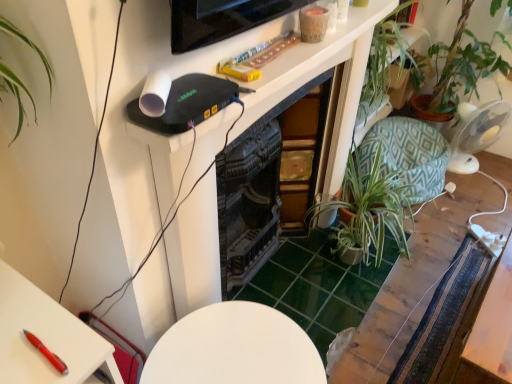
Question: Does green leafy plant at center-right have a greater height compared to wooden table at center, which is counted as the first table, starting from the back?

Choices:
 (A) no
 (B) yes

Answer: (B)

Question: Does green leafy plant at center-right have a smaller size compared to wooden table at center, which is counted as the first table, starting from the back?

Choices:
 (A) no
 (B) yes

Answer: (A)

Question: Considering the relative positions of green leafy plant at center-right and wooden table at center, which is counted as the first table, starting from the back, in the image provided, is green leafy plant at center-right to the right of wooden table at center, which is counted as the first table, starting from the back, from the viewer's perspective?

Choices:
 (A) no
 (B) yes

Answer: (A)

Question: Is green leafy plant at center-right with wooden table at center, which ranks as the 3th table in front-to-back order?

Choices:
 (A) yes
 (B) no

Answer: (B)

Question: Does green leafy plant at center-right appear on the left side of wooden table at center, which ranks as the 3th table in front-to-back order?

Choices:
 (A) no
 (B) yes

Answer: (B)

Question: Is white glossy table at center, marked as the 1th table in a front-to-back arrangement, wider or thinner than wooden table at center, which ranks as the 3th table in front-to-back order?

Choices:
 (A) wide
 (B) thin

Answer: (B)

Question: Considering the positions of white glossy table at center, which appears as the 3th table when viewed from the back, and wooden table at center, which is counted as the first table, starting from the back, in the image, is white glossy table at center, which appears as the 3th table when viewed from the back, bigger or smaller than wooden table at center, which is counted as the first table, starting from the back,?

Choices:
 (A) small
 (B) big

Answer: (B)

Question: Is white glossy table at center, which appears as the 3th table when viewed from the back, in front of or behind wooden table at center, which is counted as the first table, starting from the back, in the image?

Choices:
 (A) front
 (B) behind

Answer: (A)

Question: Would you say white glossy table at center, which appears as the 3th table when viewed from the back, is to the left or to the right of wooden table at center, which ranks as the 3th table in front-to-back order, in the picture?

Choices:
 (A) left
 (B) right

Answer: (A)

Question: In the image, is teal geometric fabric swivel chair at right positioned in front of or behind wooden table at center, which is counted as the first table, starting from the back?

Choices:
 (A) behind
 (B) front

Answer: (A)

Question: In terms of height, does teal geometric fabric swivel chair at right look taller or shorter compared to wooden table at center, which ranks as the 3th table in front-to-back order?

Choices:
 (A) short
 (B) tall

Answer: (B)

Question: Is teal geometric fabric swivel chair at right wider or thinner than wooden table at center, which ranks as the 3th table in front-to-back order?

Choices:
 (A) thin
 (B) wide

Answer: (A)

Question: Considering the relative positions of teal geometric fabric swivel chair at right and wooden table at center, which is counted as the first table, starting from the back, in the image provided, is teal geometric fabric swivel chair at right to the left or to the right of wooden table at center, which is counted as the first table, starting from the back,?

Choices:
 (A) left
 (B) right

Answer: (B)

Question: Is transparent plastic fan at right inside or outside of wooden table at center, which is counted as the first table, starting from the back?

Choices:
 (A) outside
 (B) inside

Answer: (A)

Question: From a real-world perspective, is transparent plastic fan at right positioned above or below wooden table at center, which ranks as the 3th table in front-to-back order?

Choices:
 (A) below
 (B) above

Answer: (B)